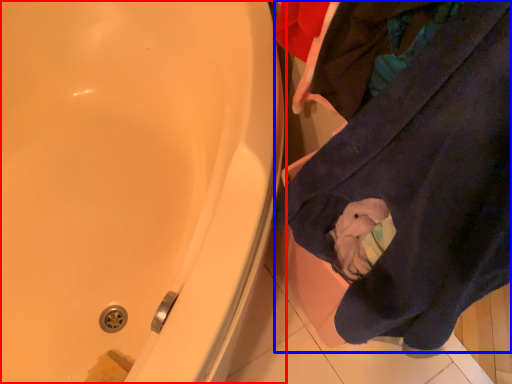
Question: Among these objects, which one is nearest to the camera, bathtub (highlighted by a red box) or clothing (highlighted by a blue box)?

Choices:
 (A) bathtub
 (B) clothing

Answer: (B)